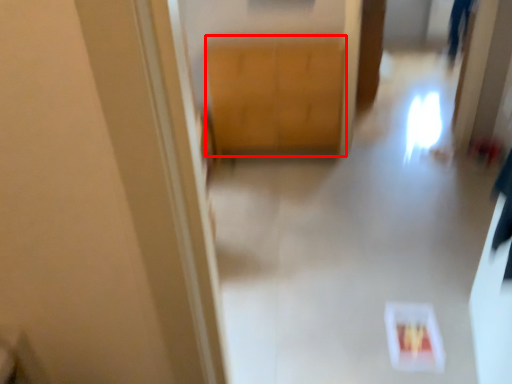
Question: In this image, where is cabinetry (annotated by the red box) located relative to path?

Choices:
 (A) right
 (B) left

Answer: (B)